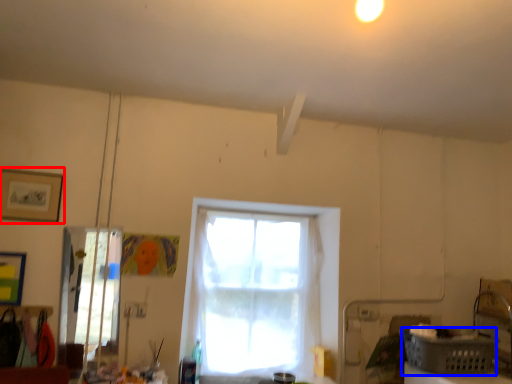
Question: Which point is further to the camera, picture frame (highlighted by a red box) or basket (highlighted by a blue box)?

Choices:
 (A) picture frame
 (B) basket

Answer: (A)